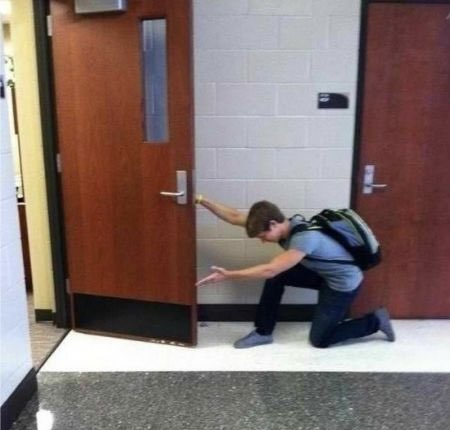
You are a GUI agent. You are given a task and a screenshot of the screen. Output one action in this format:
    pyautogui.click(x=<x>, y=<y>)
    Task: Click on the brick wall
    This screenshot has width=450, height=430.
    Given the screenshot: What is the action you would take?
    pyautogui.click(x=265, y=95), pyautogui.click(x=247, y=255), pyautogui.click(x=210, y=244)